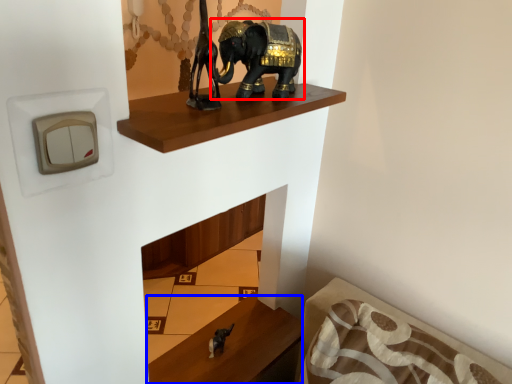
Question: Which object is closer to the camera taking this photo, elephant (highlighted by a red box) or furniture (highlighted by a blue box)?

Choices:
 (A) elephant
 (B) furniture

Answer: (A)